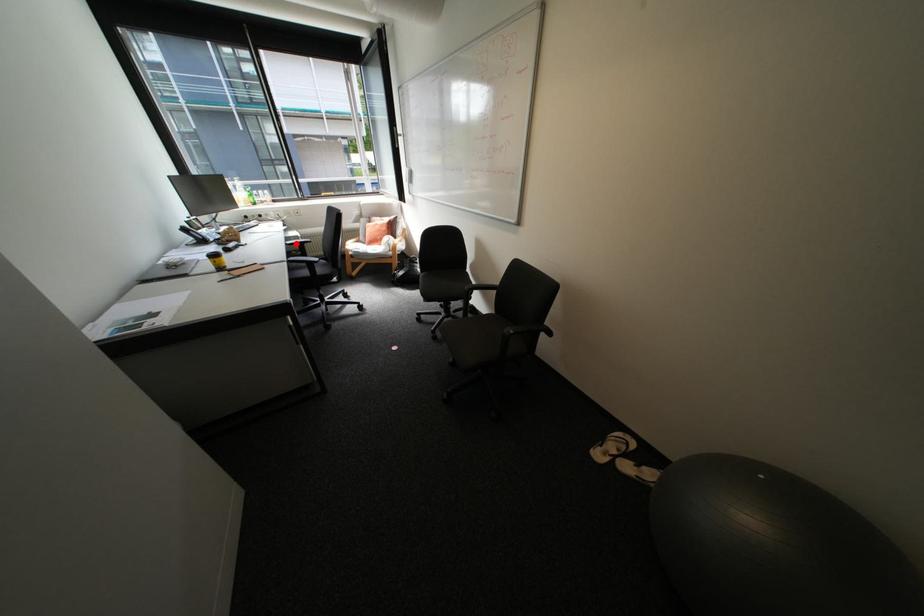
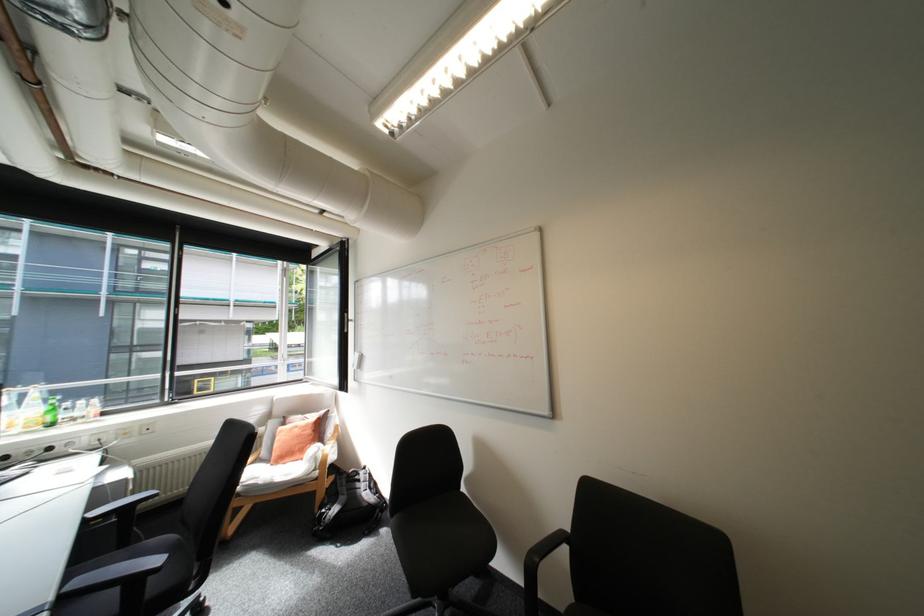
Question: A red point is marked in image1. In image2, is the corresponding 3D point closer to the camera or farther? Reply with the corresponding letter.

Choices:
 (A) The corresponding 3D point is closer.
 (B) The corresponding 3D point is farther.

Answer: (B)